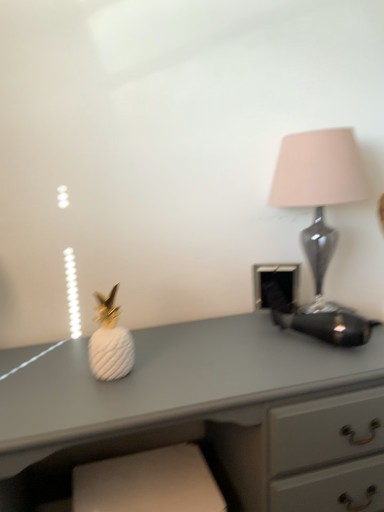
The width and height of the screenshot is (384, 512). Identify the location of free space in front of white matte pineapple at center. (92, 402).